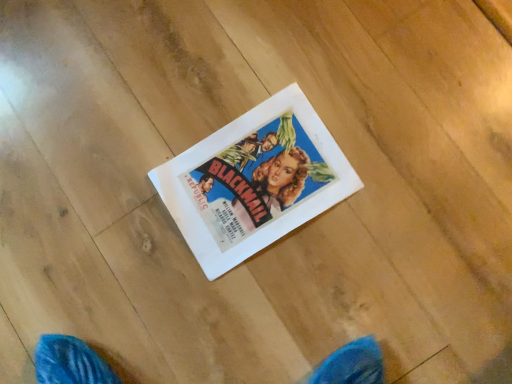
Where is `blank space situated above white paper at center (from a real-world perspective)`? The image size is (512, 384). blank space situated above white paper at center (from a real-world perspective) is located at coordinates (223, 182).